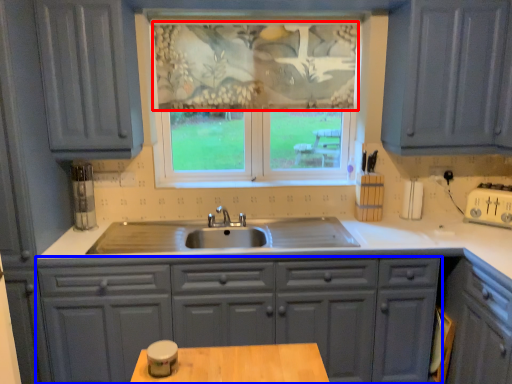
Question: Among these objects, which one is nearest to the camera, curtain (highlighted by a red box) or cabinetry (highlighted by a blue box)?

Choices:
 (A) curtain
 (B) cabinetry

Answer: (B)